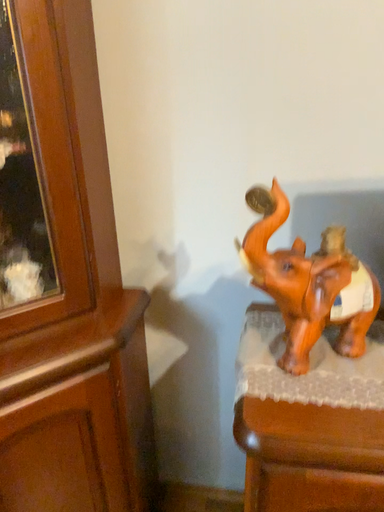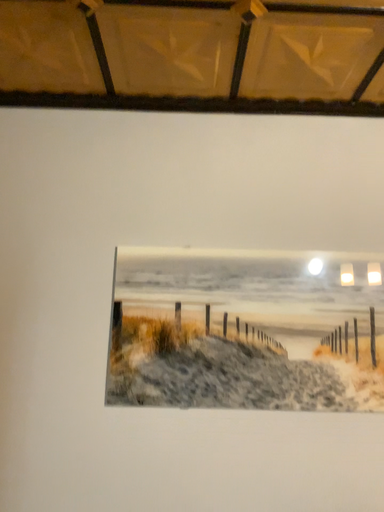
Question: How did the camera likely rotate when shooting the video?

Choices:
 (A) rotated upward
 (B) rotated downward

Answer: (A)